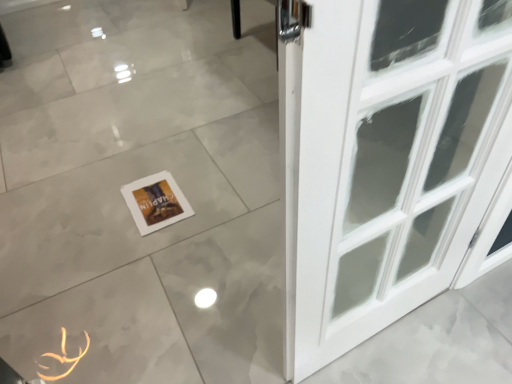
Locate an element on the screen. vacant area located to the right-hand side of orange rubber band at lower left is located at coordinates (126, 338).